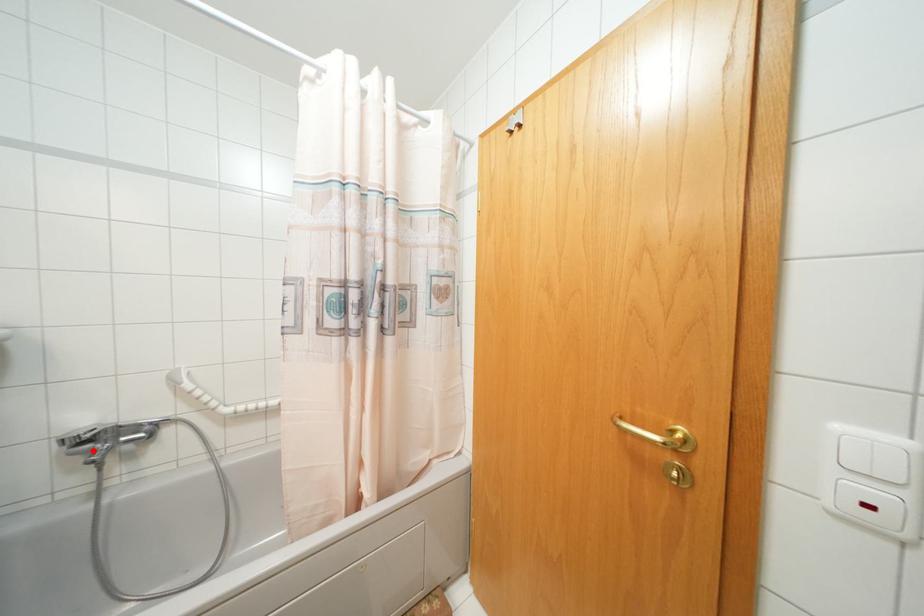
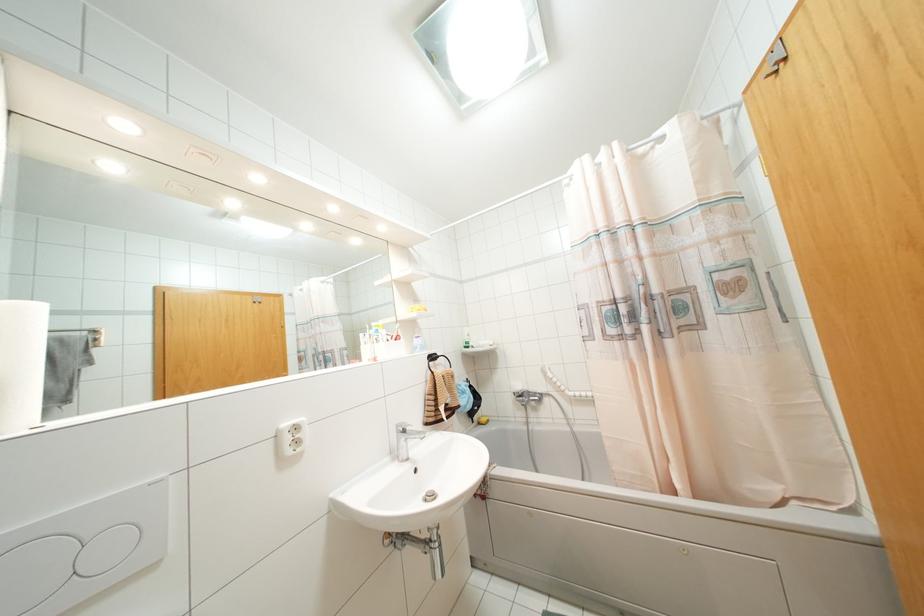
Where in the second image is the point corresponding to the highlighted location from the first image?

(523, 400)